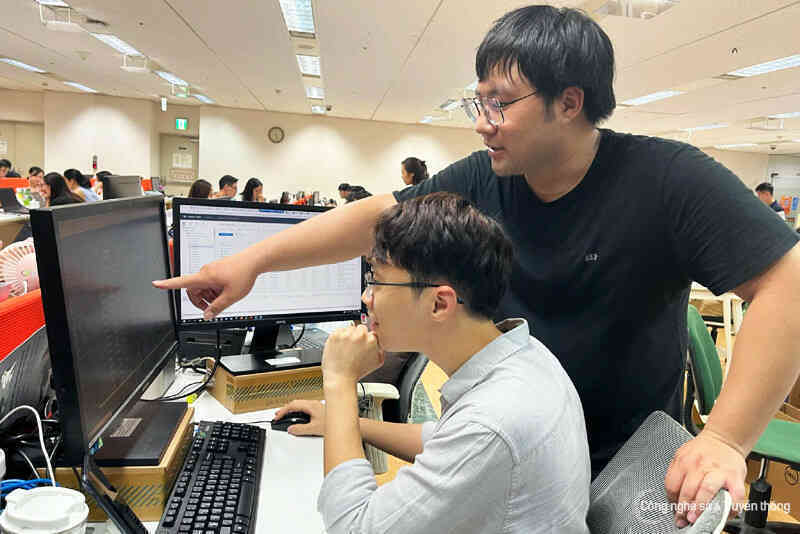
In order to click on fan in this screenshot , I will do `click(16, 255)`.